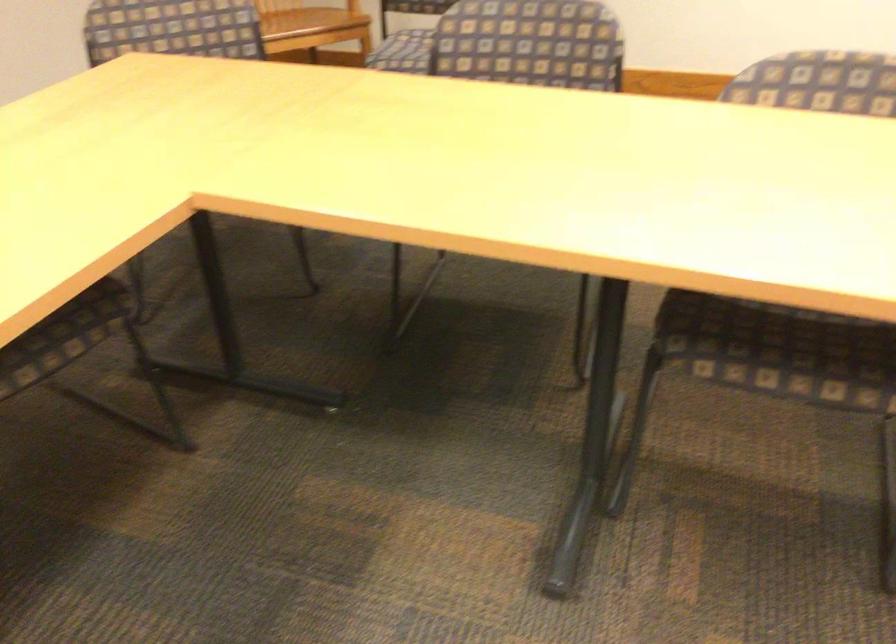
Image resolution: width=896 pixels, height=644 pixels. What do you see at coordinates (309, 23) in the screenshot?
I see `a wooden chair sitting surface` at bounding box center [309, 23].